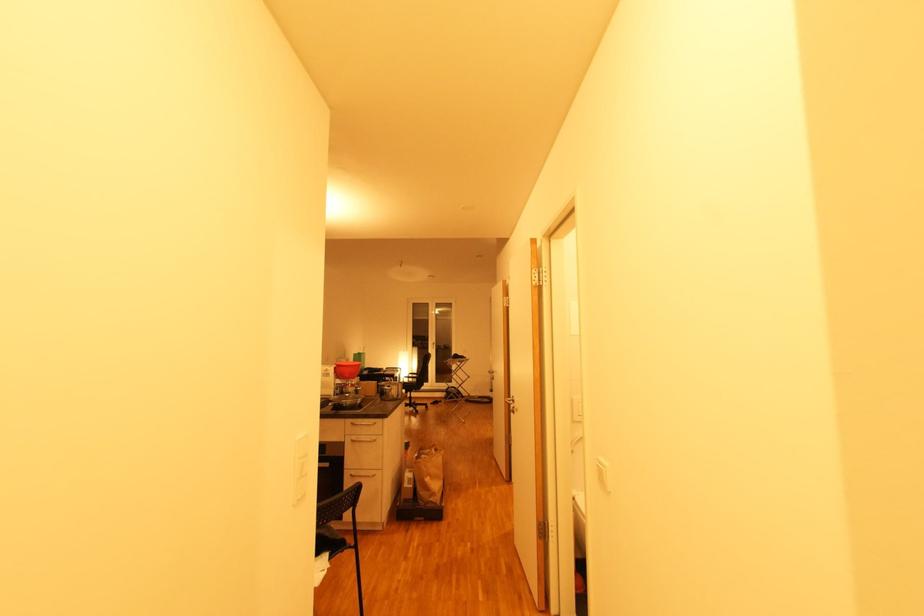
Where would you lift the brown paper bag? Please return your answer as a coordinate pair (x, y).

(428, 476)